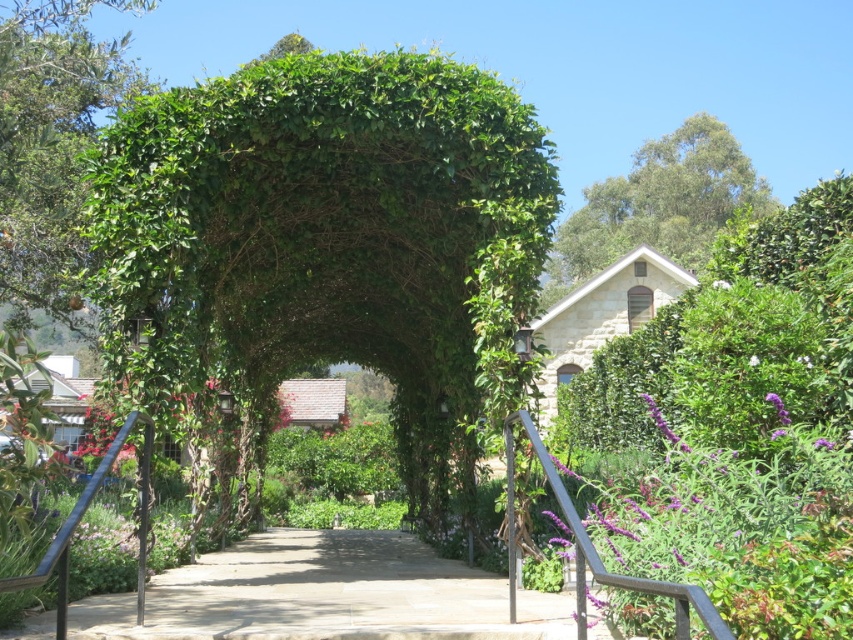
Question: Among these objects, which one is nearest to the camera?

Choices:
 (A) green leafy tree at upper right
 (B) gray concrete path at center

Answer: (B)

Question: Among these points, which one is nearest to the camera?

Choices:
 (A) (456, 620)
 (B) (692, 204)
 (C) (28, 6)

Answer: (A)

Question: Which object is positioned farthest from the green leafy tree at upper left?

Choices:
 (A) green leafy tree at upper right
 (B) gray concrete path at center

Answer: (A)

Question: Is gray concrete path at center smaller than green leafy tree at upper right?

Choices:
 (A) yes
 (B) no

Answer: (A)

Question: Does green leafy tree at upper left appear on the right side of green leafy tree at upper right?

Choices:
 (A) yes
 (B) no

Answer: (B)

Question: Is gray concrete path at center wider than green leafy tree at upper left?

Choices:
 (A) no
 (B) yes

Answer: (A)